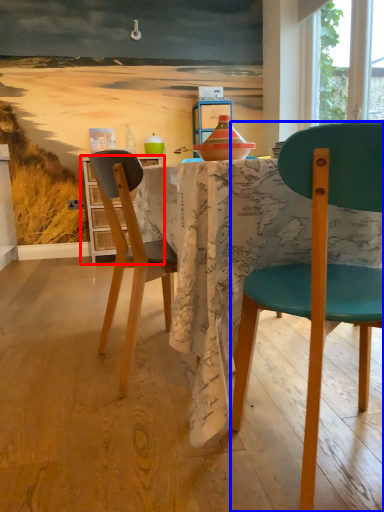
Question: Which point is closer to the camera, cabinetry (highlighted by a red box) or chair (highlighted by a blue box)?

Choices:
 (A) cabinetry
 (B) chair

Answer: (B)